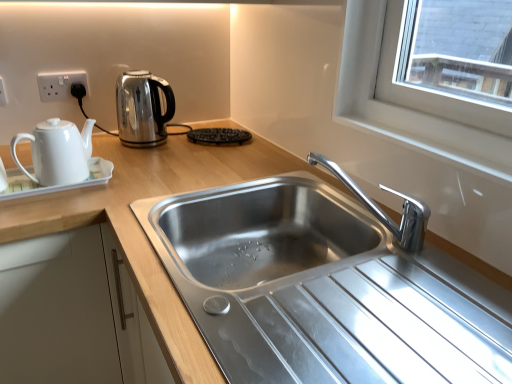
Question: Can you confirm if black textured waffle iron at center is smaller than chrome metallic faucet at center?

Choices:
 (A) no
 (B) yes

Answer: (B)

Question: Does black textured waffle iron at center appear on the right side of chrome metallic faucet at center?

Choices:
 (A) no
 (B) yes

Answer: (A)

Question: Is black textured waffle iron at center next to chrome metallic faucet at center and touching it?

Choices:
 (A) yes
 (B) no

Answer: (B)

Question: From the image's perspective, is black textured waffle iron at center located beneath chrome metallic faucet at center?

Choices:
 (A) yes
 (B) no

Answer: (B)

Question: From the image's perspective, is black textured waffle iron at center on top of chrome metallic faucet at center?

Choices:
 (A) yes
 (B) no

Answer: (A)

Question: From a real-world perspective, is chrome metallic faucet at center physically located above or below white glossy teapot at left, arranged as the second kettle when viewed from the back?

Choices:
 (A) below
 (B) above

Answer: (A)

Question: From the image's perspective, is chrome metallic faucet at center located above or below white glossy teapot at left, arranged as the second kettle when viewed from the back?

Choices:
 (A) below
 (B) above

Answer: (A)

Question: Is chrome metallic faucet at center wider or thinner than white glossy teapot at left, the 1th kettle from the front?

Choices:
 (A) thin
 (B) wide

Answer: (B)

Question: Choose the correct answer: Is chrome metallic faucet at center inside white glossy teapot at left, arranged as the second kettle when viewed from the back, or outside it?

Choices:
 (A) outside
 (B) inside

Answer: (A)

Question: Considering the positions of point (4, 97) and point (351, 180), is point (4, 97) closer or farther from the camera than point (351, 180)?

Choices:
 (A) farther
 (B) closer

Answer: (A)

Question: Considering the positions of white plastic electric outlet at upper left, the second electric outlet viewed from the right, and chrome metallic faucet at center in the image, is white plastic electric outlet at upper left, the second electric outlet viewed from the right, bigger or smaller than chrome metallic faucet at center?

Choices:
 (A) big
 (B) small

Answer: (B)

Question: In the image, is white plastic electric outlet at upper left, which ranks as the 1th electric outlet in left-to-right order, positioned in front of or behind chrome metallic faucet at center?

Choices:
 (A) front
 (B) behind

Answer: (B)

Question: In the image, is white plastic electric outlet at upper left, acting as the 1th electric outlet starting from the front, on the left side or the right side of chrome metallic faucet at center?

Choices:
 (A) right
 (B) left

Answer: (B)

Question: In terms of size, does white plastic socket at upper left, placed as the first electric outlet when sorted from back to front, appear bigger or smaller than white glossy teapot at left, arranged as the second kettle when viewed from the back?

Choices:
 (A) big
 (B) small

Answer: (B)

Question: Considering the relative positions of white plastic socket at upper left, placed as the first electric outlet when sorted from back to front, and white glossy teapot at left, arranged as the second kettle when viewed from the back, in the image provided, is white plastic socket at upper left, placed as the first electric outlet when sorted from back to front, to the left or to the right of white glossy teapot at left, arranged as the second kettle when viewed from the back,?

Choices:
 (A) left
 (B) right

Answer: (A)